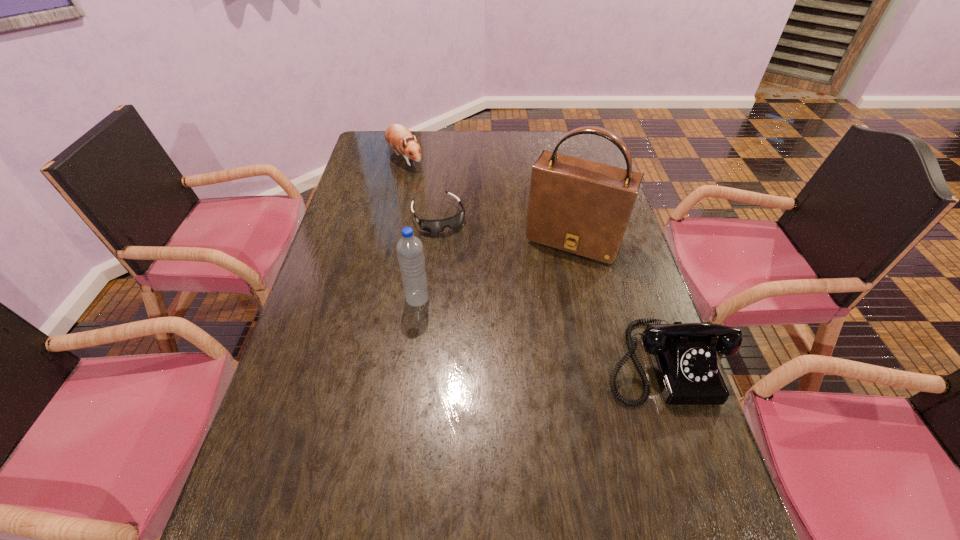
The height and width of the screenshot is (540, 960). What are the coordinates of `object that is the third closest to the shortest object` in the screenshot? It's located at (410, 254).

Locate an element on the screen. The width and height of the screenshot is (960, 540). vacant area that satisfies the following two spatial constraints: 1. on the back side of the fourth shortest object; 2. on the right side of the shortest object is located at coordinates tap(428, 217).

Image resolution: width=960 pixels, height=540 pixels. In order to click on free location that satisfies the following two spatial constraints: 1. on the back side of the fourth farthest object; 2. on the left side of the goggles in this screenshot , I will do `click(428, 217)`.